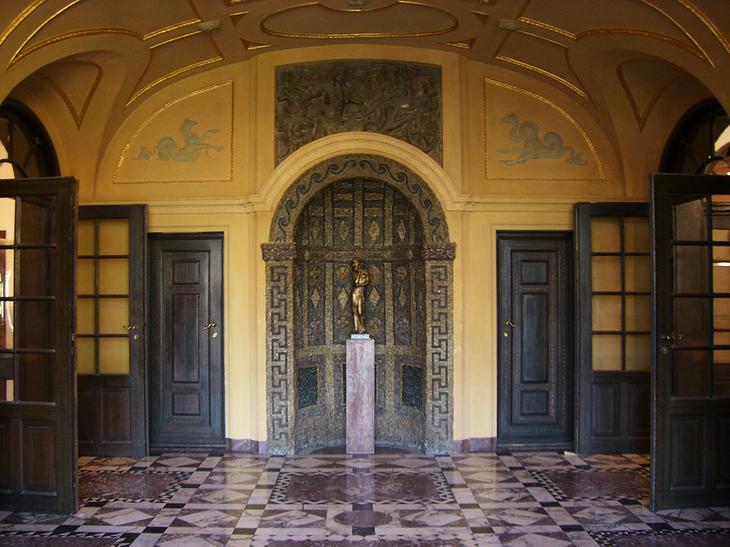
Find the location of a particular element. The width and height of the screenshot is (730, 547). open door is located at coordinates (679, 476), (612, 418), (42, 435), (104, 413).